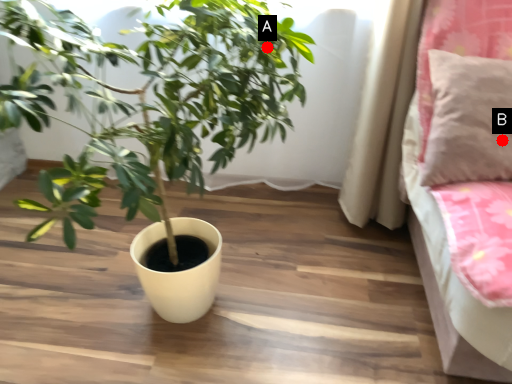
Question: Two points are circled on the image, labeled by A and B beside each circle. Which point is farther from the camera taking this photo?

Choices:
 (A) A is further
 (B) B is further

Answer: (A)